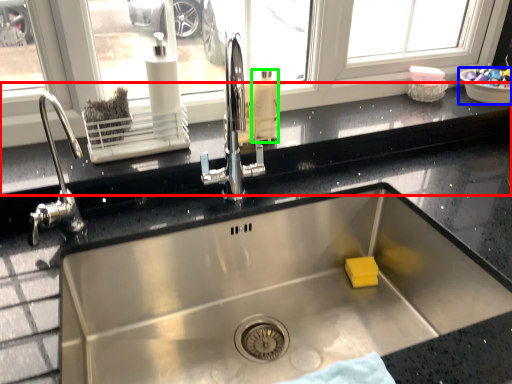
Question: Which is farther away from window sill (highlighted by a red box)? basin (highlighted by a blue box) or cleaning product (highlighted by a green box)?

Choices:
 (A) basin
 (B) cleaning product

Answer: (A)